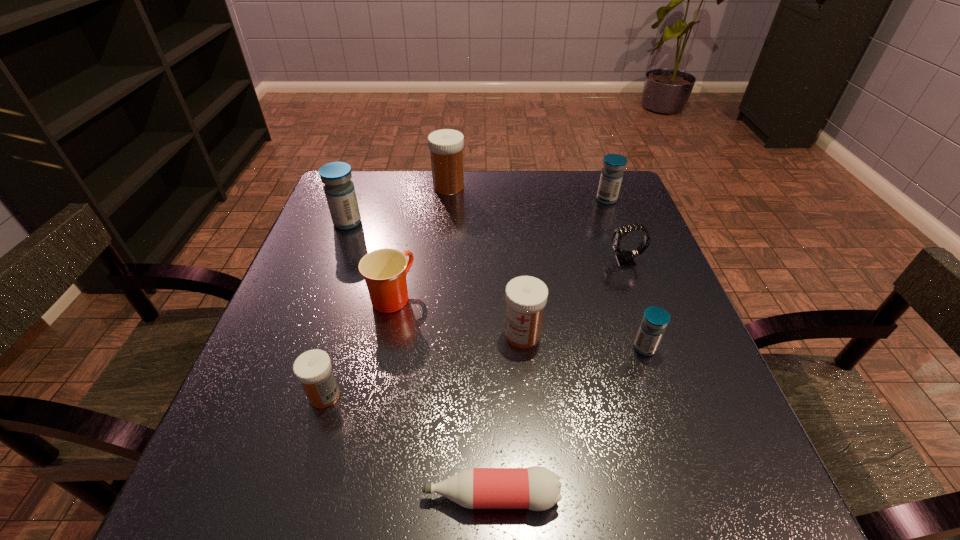
This screenshot has height=540, width=960. I want to click on watch that is at the right edge, so click(x=625, y=258).

The image size is (960, 540). What are the coordinates of `object located in the far left corner section of the desktop` in the screenshot? It's located at (339, 190).

The image size is (960, 540). I want to click on object present at the far right corner, so click(612, 173).

At what (x,y) coordinates should I click in order to perform the action: click on blank space at the far edge. Please return your answer as a coordinate pair (x, y). This screenshot has height=540, width=960. Looking at the image, I should click on (521, 187).

Find the location of `vacant area at the near edge`. vacant area at the near edge is located at coordinates (337, 504).

Where is `vacant space at the left edge of the desktop`? This screenshot has height=540, width=960. vacant space at the left edge of the desktop is located at coordinates (361, 225).

The width and height of the screenshot is (960, 540). In order to click on vacant space at the right edge in this screenshot , I will do `click(671, 459)`.

Find the location of a particular element. The width and height of the screenshot is (960, 540). vacant space at the far left corner is located at coordinates (391, 173).

The width and height of the screenshot is (960, 540). In the image, there is a desktop. Find the location of `vacant space at the far right corner`. vacant space at the far right corner is located at coordinates (590, 214).

You are a GUI agent. You are given a task and a screenshot of the screen. Output one action in this format:
    pyautogui.click(x=<x>, y=<y>)
    Task: Click on the vacant space at the near right corner
    This screenshot has width=960, height=540.
    Given the screenshot: What is the action you would take?
    (x=708, y=474)